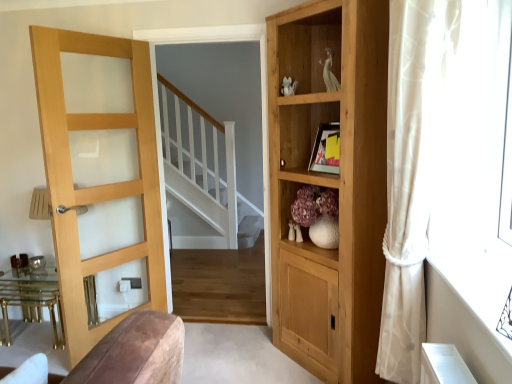
Question: In terms of width, does sheer white curtain at right look wider or thinner when compared to light wood/glass door at left?

Choices:
 (A) thin
 (B) wide

Answer: (B)

Question: From a real-world perspective, is sheer white curtain at right positioned above or below light wood/glass door at left?

Choices:
 (A) above
 (B) below

Answer: (A)

Question: Which object is positioned farthest from the light wood/glass door at left?

Choices:
 (A) natural wood cupboard at right
 (B) sheer white curtain at right
 (C) gold metallic table at left
 (D) white matte vase at center

Answer: (B)

Question: Which of these objects is positioned farthest from the light wood/glass door at left?

Choices:
 (A) gold metallic table at left
 (B) natural wood cupboard at right
 (C) white matte vase at center
 (D) sheer white curtain at right

Answer: (D)